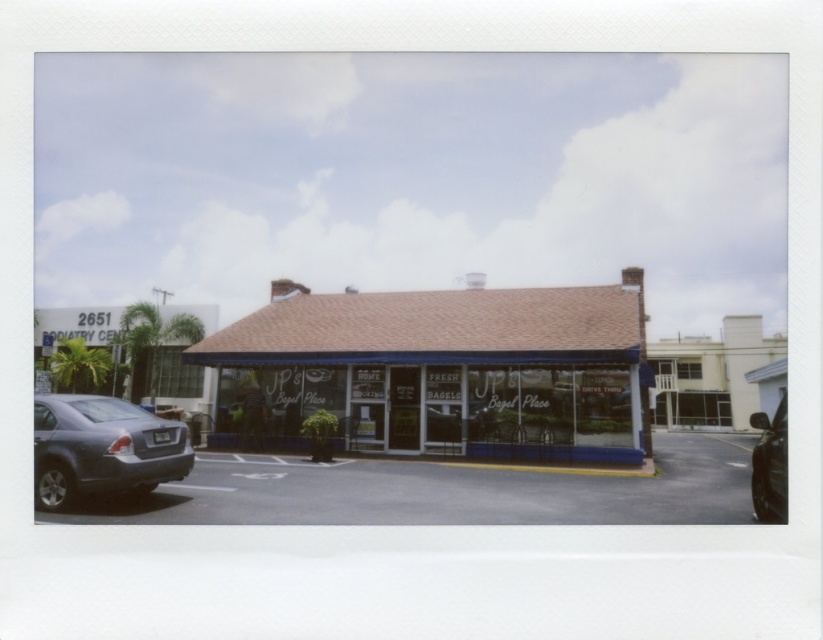
Based on the photo, is gray asphalt parking lot at lower left wider than shiny black car at lower right?

Correct, the width of gray asphalt parking lot at lower left exceeds that of shiny black car at lower right.

Can you confirm if gray asphalt parking lot at lower left is smaller than shiny black car at lower right?

Correct, gray asphalt parking lot at lower left occupies less space than shiny black car at lower right.

Locate an element on the screen. This screenshot has height=640, width=823. gray asphalt parking lot at lower left is located at coordinates (447, 492).

Can you confirm if matte gray sedan at lower left is taller than shiny black car at lower right?

No.

Does point (136, 442) come in front of point (754, 483)?

That is True.

Who is more distant from viewer, (123,403) or (751,422)?

The point (751,422) is more distant.

Where is `matte gray sedan at lower left`? The width and height of the screenshot is (823, 640). matte gray sedan at lower left is located at coordinates (101, 449).

From the picture: Does gray asphalt parking lot at lower left have a larger size compared to matte gray sedan at lower left?

Yes.

Is point (100, 506) positioned behind point (117, 401)?

No, it is in front of (117, 401).

Locate an element on the screen. This screenshot has height=640, width=823. gray asphalt parking lot at lower left is located at coordinates (447, 492).